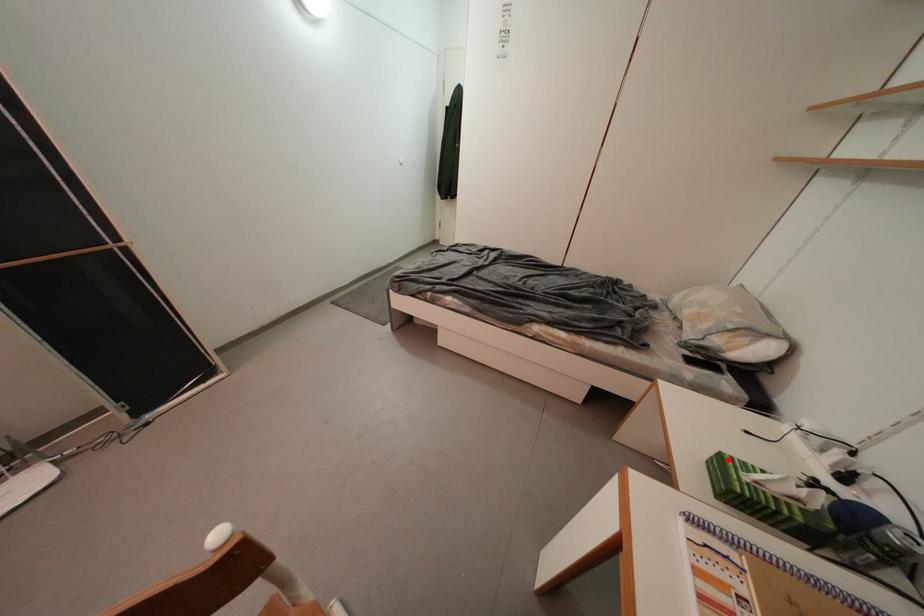
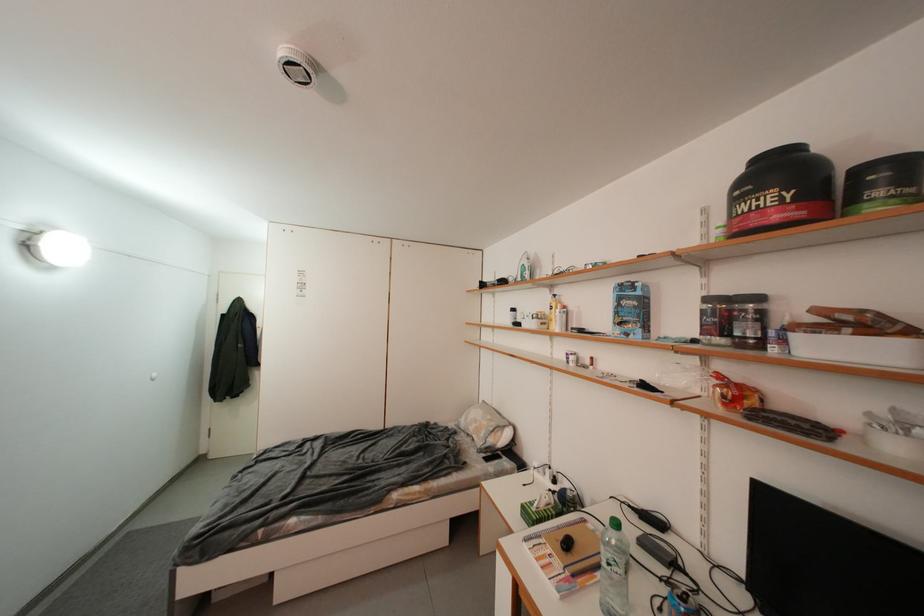
Question: I am providing you with two images of the same scene from different viewpoints. In image1, a red point is highlighted. Considering the same 3D point in image2, which of the following is correct?

Choices:
 (A) It is closer
 (B) It is farther

Answer: (A)